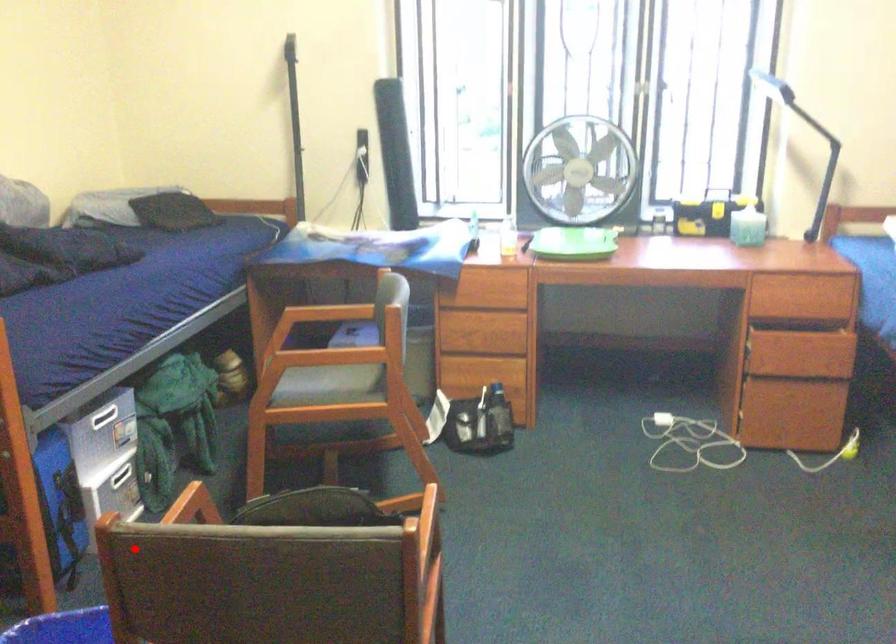
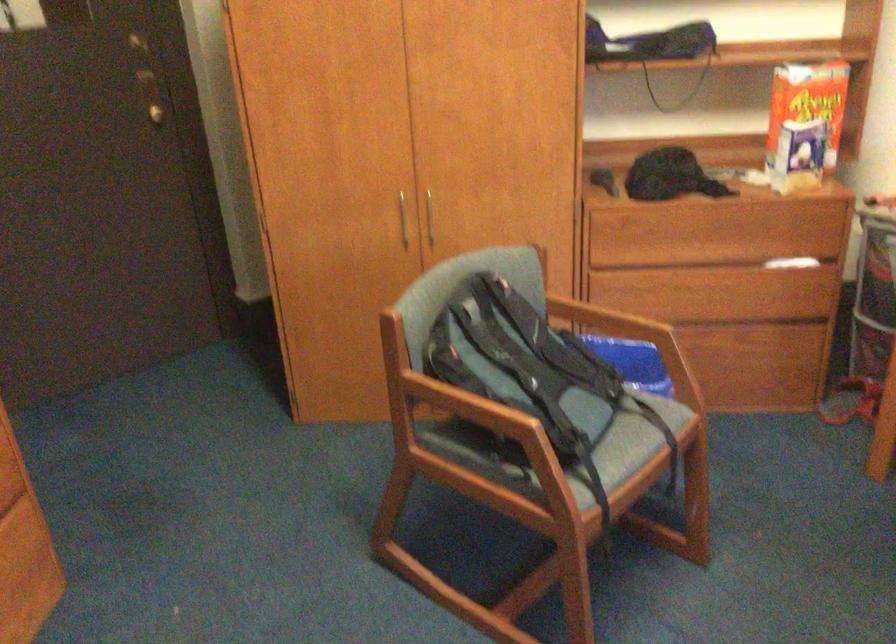
Question: I am providing you with two images of the same scene from different viewpoints. Image1 has a red point marked. In image2, the corresponding 3D location appears at what relative position? Reply with the corresponding letter.

Choices:
 (A) Closer
 (B) Farther

Answer: (B)